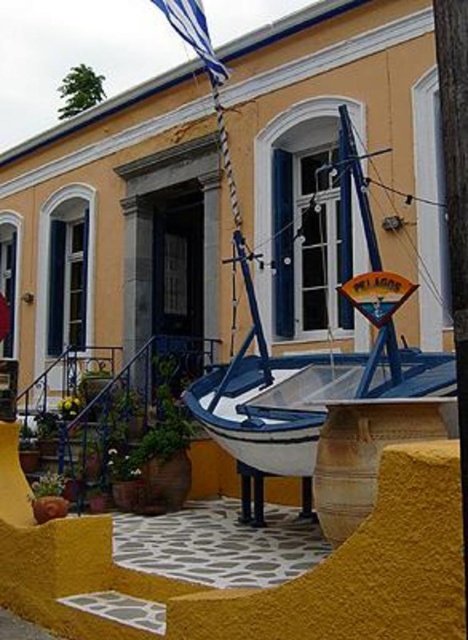
You are a visitor approaching the building and want to take a photo of the blue fabric flag at upper center without the smooth wooden pole at center blocking the view. Is this possible from your current position?

The smooth wooden pole at center is in front of the blue fabric flag at upper center, so it will block the view. Move to a position where you can see around or behind the pole to capture the flag without obstruction.

You are a visitor approaching the building and notice the blue painted wood boat at center and the blue fabric flag at upper center. Which object is closer to the entrance of the building?

The blue painted wood boat at center is positioned on the right side of the blue fabric flag at upper center, so the boat is closer to the entrance than the flag.